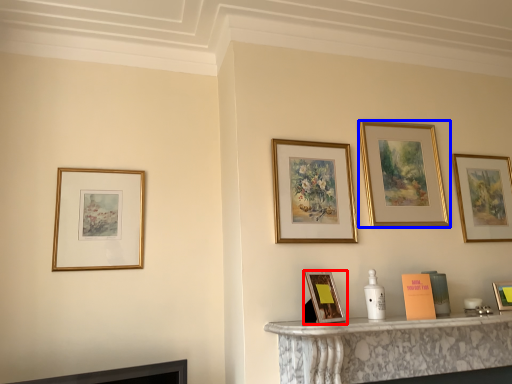
Question: Among these objects, which one is nearest to the camera, picture frame (highlighted by a red box) or picture frame (highlighted by a blue box)?

Choices:
 (A) picture frame
 (B) picture frame

Answer: (A)